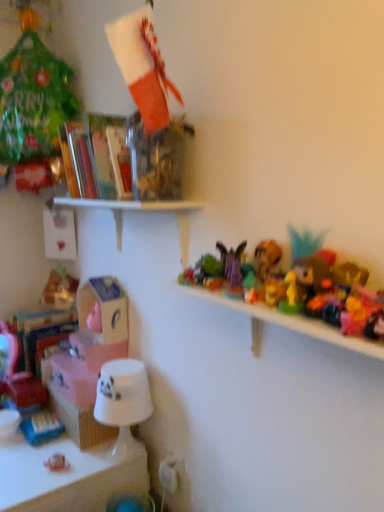
Question: Is white cardboard box at center-left, which is the second box in bottom-to-top order, positioned with its back to pink matte box at lower left, the 1th box in the bottom-to-top sequence?

Choices:
 (A) no
 (B) yes

Answer: (A)

Question: From the image's perspective, does white cardboard box at center-left, which is the second box in bottom-to-top order, appear higher than pink matte box at lower left, the 1th box in the bottom-to-top sequence?

Choices:
 (A) no
 (B) yes

Answer: (B)

Question: From the image's perspective, is white cardboard box at center-left, which is the second box in bottom-to-top order, located beneath pink matte box at lower left, the 1th box in the bottom-to-top sequence?

Choices:
 (A) yes
 (B) no

Answer: (B)

Question: From a real-world perspective, is white cardboard box at center-left, which is the second box in bottom-to-top order, beneath pink matte box at lower left, positioned as the 2th box in top-to-bottom order?

Choices:
 (A) no
 (B) yes

Answer: (A)

Question: Is white cardboard box at center-left, the first box when ordered from top to bottom, wider than pink matte box at lower left, positioned as the 2th box in top-to-bottom order?

Choices:
 (A) yes
 (B) no

Answer: (B)

Question: Is white cardboard box at center-left, the first box when ordered from top to bottom, at the left side of pink matte box at lower left, the 1th box in the bottom-to-top sequence?

Choices:
 (A) yes
 (B) no

Answer: (B)

Question: From a real-world perspective, is white matte shelf at upper center, placed as the 2th shelf when sorted from top to bottom, under translucent plastic books at upper left, marked as the 3th shelf in a bottom-to-top arrangement?

Choices:
 (A) yes
 (B) no

Answer: (A)

Question: From a real-world perspective, is white matte shelf at upper center, which is the second shelf from bottom to top, physically above translucent plastic books at upper left, marked as the 3th shelf in a bottom-to-top arrangement?

Choices:
 (A) yes
 (B) no

Answer: (B)

Question: Is the position of white matte shelf at upper center, placed as the 2th shelf when sorted from top to bottom, more distant than that of translucent plastic books at upper left, marked as the 3th shelf in a bottom-to-top arrangement?

Choices:
 (A) yes
 (B) no

Answer: (B)

Question: Can translucent plastic books at upper left, marked as the 3th shelf in a bottom-to-top arrangement, be found inside white matte shelf at upper center, placed as the 2th shelf when sorted from top to bottom?

Choices:
 (A) yes
 (B) no

Answer: (B)

Question: Are white matte shelf at upper center, which is the second shelf from bottom to top, and translucent plastic books at upper left, marked as the 3th shelf in a bottom-to-top arrangement, beside each other?

Choices:
 (A) no
 (B) yes

Answer: (B)

Question: Is white matte shelf at upper center, which is the second shelf from bottom to top, aimed at translucent plastic books at upper left, which is the first shelf in top-to-bottom order?

Choices:
 (A) no
 (B) yes

Answer: (A)

Question: Does purple fabric butterfly at upper center, which appears as the 2th toy when viewed from the top, have a greater height compared to white glossy lampshade at lower left?

Choices:
 (A) no
 (B) yes

Answer: (A)